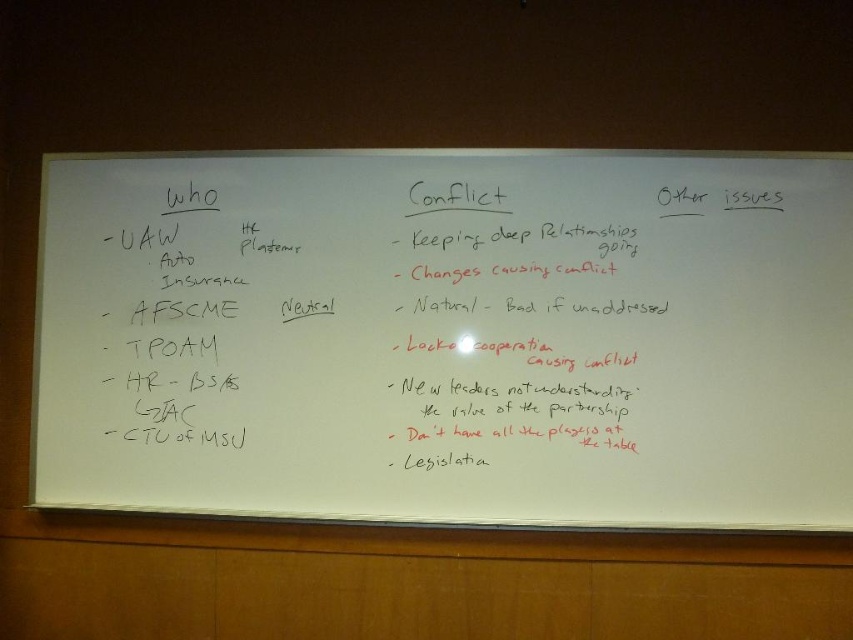
Measure the distance between whiteboard at center and black marker text at center.

whiteboard at center and black marker text at center are 4.58 inches apart.

Looking at this image, can you confirm if whiteboard at center is positioned to the right of black marker text at center?

In fact, whiteboard at center is to the left of black marker text at center.

Measure the distance between whiteboard at center and camera.

The distance of whiteboard at center from camera is 1.94 meters.

Find the location of a particular element. whiteboard at center is located at coordinates (450, 337).